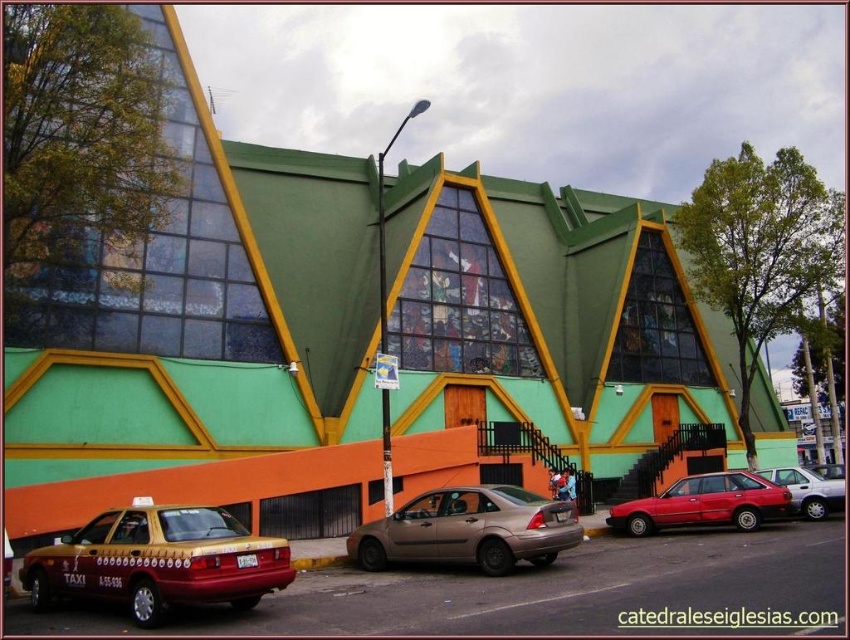
Question: Which object is the closest to the metallic gold taxi at lower left?

Choices:
 (A) metallic silver sedan at center
 (B) matte red sedan at center
 (C) gold metallic sedan at center

Answer: (C)

Question: Does shiny red sedan at center have a greater width compared to matte red sedan at center?

Choices:
 (A) yes
 (B) no

Answer: (A)

Question: Based on their relative distances, which object is farther from the gold metallic sedan at center?

Choices:
 (A) metallic silver sedan at center
 (B) matte red sedan at center
 (C) shiny red sedan at center

Answer: (A)

Question: Which of these objects is positioned closest to the matte red sedan at center?

Choices:
 (A) metallic silver sedan at center
 (B) metallic gold taxi at lower left

Answer: (A)

Question: Does metallic gold taxi at lower left appear under matte red sedan at center?

Choices:
 (A) no
 (B) yes

Answer: (A)

Question: Does gold metallic sedan at center have a lesser width compared to matte red sedan at center?

Choices:
 (A) yes
 (B) no

Answer: (B)